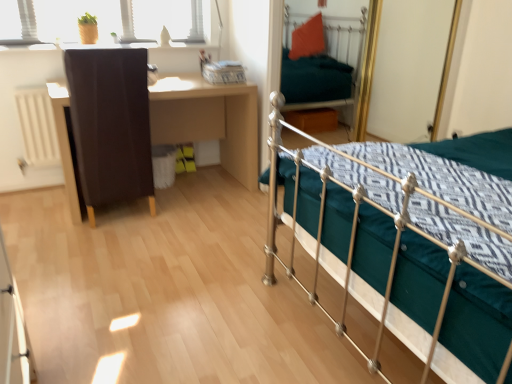
Question: Is matte brown cabinet at left a part of metallic green bed at center?

Choices:
 (A) no
 (B) yes

Answer: (A)

Question: Is metallic green bed at center positioned beyond the bounds of matte brown cabinet at left?

Choices:
 (A) yes
 (B) no

Answer: (A)

Question: From a real-world perspective, is metallic green bed at center positioned over matte brown cabinet at left based on gravity?

Choices:
 (A) yes
 (B) no

Answer: (A)

Question: Considering the relative positions of metallic green bed at center and matte brown cabinet at left in the image provided, is metallic green bed at center to the left of matte brown cabinet at left from the viewer's perspective?

Choices:
 (A) yes
 (B) no

Answer: (B)

Question: Does metallic green bed at center have a greater width compared to matte brown cabinet at left?

Choices:
 (A) no
 (B) yes

Answer: (B)

Question: Is metallic green bed at center bigger or smaller than matte brown cabinet at left?

Choices:
 (A) small
 (B) big

Answer: (B)

Question: Considering the positions of metallic green bed at center and matte brown cabinet at left in the image, is metallic green bed at center wider or thinner than matte brown cabinet at left?

Choices:
 (A) thin
 (B) wide

Answer: (B)

Question: From the image's perspective, is metallic green bed at center above or below matte brown cabinet at left?

Choices:
 (A) above
 (B) below

Answer: (B)

Question: Is metallic green bed at center taller or shorter than matte brown cabinet at left?

Choices:
 (A) tall
 (B) short

Answer: (A)

Question: Looking at the image, does metallic green bed at center seem bigger or smaller compared to brown wooden desk at left?

Choices:
 (A) big
 (B) small

Answer: (A)

Question: Is metallic green bed at center inside the boundaries of brown wooden desk at left, or outside?

Choices:
 (A) outside
 (B) inside

Answer: (A)

Question: Considering their positions, is metallic green bed at center located in front of or behind brown wooden desk at left?

Choices:
 (A) front
 (B) behind

Answer: (A)

Question: From the image's perspective, relative to brown wooden desk at left, is metallic green bed at center above or below?

Choices:
 (A) below
 (B) above

Answer: (A)

Question: From a real-world perspective, is brown wooden desk at left positioned above or below matte brown cabinet at left?

Choices:
 (A) above
 (B) below

Answer: (B)

Question: Is point (67, 190) positioned closer to the camera than point (131, 195)?

Choices:
 (A) closer
 (B) farther

Answer: (B)